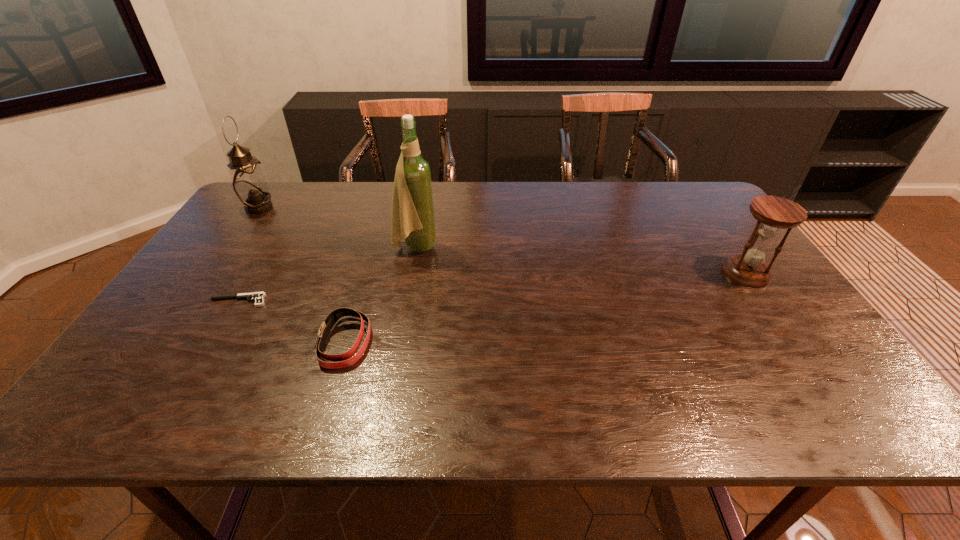
The image size is (960, 540). In order to click on the fourth object from left to right in this screenshot , I will do `click(412, 217)`.

At what (x,y) coordinates should I click in order to perform the action: click on wine bottle. Please return your answer as a coordinate pair (x, y). The image size is (960, 540). Looking at the image, I should click on (412, 217).

Where is `oil lamp`? This screenshot has width=960, height=540. oil lamp is located at coordinates (249, 184).

In order to click on the second tallest object in this screenshot , I will do `click(249, 184)`.

What are the coordinates of `the rightmost object` in the screenshot? It's located at (773, 213).

Image resolution: width=960 pixels, height=540 pixels. I want to click on hourglass, so click(x=773, y=213).

You are a GUI agent. You are given a task and a screenshot of the screen. Output one action in this format:
    pyautogui.click(x=<x>, y=<y>)
    Task: Click on the dog collar
    
    Given the screenshot: What is the action you would take?
    pyautogui.click(x=346, y=359)

What are the coordinates of `the nearest object` in the screenshot? It's located at (346, 359).

In order to click on the shortest object in this screenshot , I will do `click(258, 297)`.

Where is `pistol`? pistol is located at coordinates (258, 297).